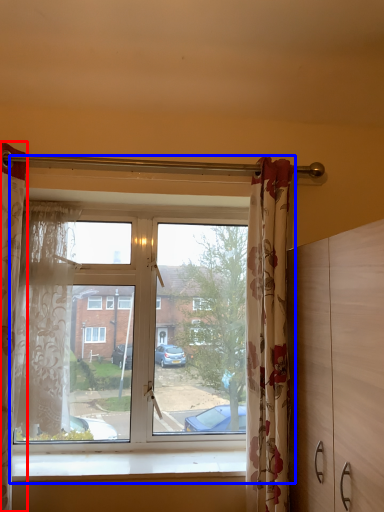
Question: Which point is closer to the camera, curtain (highlighted by a red box) or window (highlighted by a blue box)?

Choices:
 (A) curtain
 (B) window

Answer: (A)